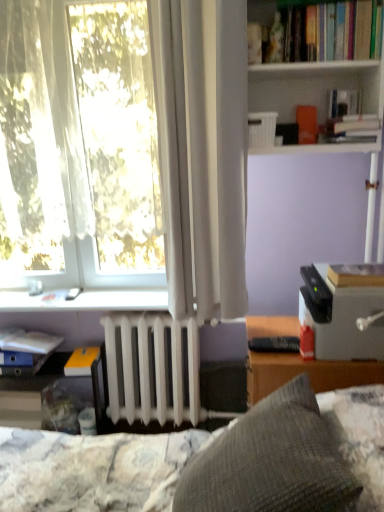
The width and height of the screenshot is (384, 512). Find the location of `hardcover book at upper right, which appears as the second book when viewed from the front`. hardcover book at upper right, which appears as the second book when viewed from the front is located at coordinates (318, 30).

Image resolution: width=384 pixels, height=512 pixels. Describe the element at coordinates (81, 361) in the screenshot. I see `yellow matte book at lower left, the first book in the back-to-front sequence` at that location.

This screenshot has width=384, height=512. In order to click on hardcover book at upper right, which appears as the first book when viewed from the top in this screenshot , I will do `click(318, 30)`.

Can you tell me how much black plastic printer at right and white plastic shelf at upper center, arranged as the 1th shelf when viewed from the front, differ in facing direction?

There is a 91.3-degree angle between the facing directions of black plastic printer at right and white plastic shelf at upper center, arranged as the 1th shelf when viewed from the front.

Looking at this image, between black plastic printer at right and white plastic shelf at upper center, the 2th shelf from the bottom, which one is positioned in front?

white plastic shelf at upper center, the 2th shelf from the bottom, is closer to the camera.

Is black plastic printer at right wider than white plastic shelf at upper center, marked as the 2th shelf in a back-to-front arrangement?

Indeed, black plastic printer at right has a greater width compared to white plastic shelf at upper center, marked as the 2th shelf in a back-to-front arrangement.

Does black plastic printer at right appear on the right side of white plastic shelf at upper center, marked as the 2th shelf in a back-to-front arrangement?

Yes.

Is black plastic printer at right located outside white plastic window sill at lower left?

Yes, black plastic printer at right is not within white plastic window sill at lower left.

Considering the relative positions of black plastic printer at right and white plastic window sill at lower left in the image provided, is black plastic printer at right to the right of white plastic window sill at lower left from the viewer's perspective?

Indeed, black plastic printer at right is positioned on the right side of white plastic window sill at lower left.

Who is shorter, black plastic printer at right or white plastic window sill at lower left?

With less height is white plastic window sill at lower left.

From the image's perspective, is hardcover book at upper center, which is counted as the 2th book, starting from the top, on top of white plastic window sill at lower left?

Correct, hardcover book at upper center, which is counted as the 2th book, starting from the top, appears higher than white plastic window sill at lower left in the image.

Is hardcover book at upper center, the 5th book from the left, to the left or to the right of white plastic window sill at lower left in the image?

hardcover book at upper center, the 5th book from the left, is to the right of white plastic window sill at lower left.

Considering the relative sizes of hardcover book at upper center, the fourth book from the bottom, and white plastic window sill at lower left in the image provided, is hardcover book at upper center, the fourth book from the bottom, bigger than white plastic window sill at lower left?

No.

Are hardcover book at upper center, the fourth book from the bottom, and white plastic window sill at lower left far apart?

Yes, hardcover book at upper center, the fourth book from the bottom, and white plastic window sill at lower left are quite far apart.

From the image's perspective, is translucent plastic shelf at lower left, which appears as the second shelf when viewed from the front, located beneath hardcover book at right, positioned as the 5th book in back-to-front order?

Yes.

Is translucent plastic shelf at lower left, which ranks as the second shelf in top-to-bottom order, directly adjacent to hardcover book at right, the 1th book from the front?

No, translucent plastic shelf at lower left, which ranks as the second shelf in top-to-bottom order, is not making contact with hardcover book at right, the 1th book from the front.

From a real-world perspective, which object rests below the other?

translucent plastic shelf at lower left, acting as the 1th shelf starting from the back.

Considering the sizes of white fabric curtain at center and white plastic shelf at upper center, marked as the 2th shelf in a back-to-front arrangement, in the image, is white fabric curtain at center bigger or smaller than white plastic shelf at upper center, marked as the 2th shelf in a back-to-front arrangement,?

Considering their sizes, white fabric curtain at center takes up less space than white plastic shelf at upper center, marked as the 2th shelf in a back-to-front arrangement.

Is white fabric curtain at center looking in the opposite direction of white plastic shelf at upper center, the 1th shelf viewed from the top?

Absolutely, white fabric curtain at center is directed away from white plastic shelf at upper center, the 1th shelf viewed from the top.

Is white fabric curtain at center taller or shorter than white plastic shelf at upper center, arranged as the 1th shelf when viewed from the front?

Clearly, white fabric curtain at center is shorter compared to white plastic shelf at upper center, arranged as the 1th shelf when viewed from the front.

You are a GUI agent. You are given a task and a screenshot of the screen. Output one action in this format:
    pyautogui.click(x=<x>, y=<y>)
    Task: Click on the 4th book positioned below the white matte bookshelf at upper right (from a real-world perspective)
    The width and height of the screenshot is (384, 512).
    Given the screenshot: What is the action you would take?
    pyautogui.click(x=81, y=361)

Is yellow matte book at lower left, which appears as the fifth book when viewed from the front, wider or thinner than white matte bookshelf at upper right?

In the image, yellow matte book at lower left, which appears as the fifth book when viewed from the front, appears to be more narrow than white matte bookshelf at upper right.

How different are the orientations of yellow matte book at lower left, the first book in the back-to-front sequence, and white matte bookshelf at upper right in degrees?

They differ by 1.59 degrees in their facing directions.

In the image, is yellow matte book at lower left, the first book in the back-to-front sequence, on the left side or the right side of white matte bookshelf at upper right?

yellow matte book at lower left, the first book in the back-to-front sequence, is positioned on white matte bookshelf at upper right's left side.

Between white matte bookshelf at upper right and hardcover book at upper center, positioned as the third book in back-to-front order, which one has larger width?

white matte bookshelf at upper right is wider.

Is point (288, 152) less distant than point (332, 118)?

That is False.

Is white matte bookshelf at upper right situated inside hardcover book at upper center, arranged as the third book when viewed from the front, or outside?

white matte bookshelf at upper right is spatially situated outside hardcover book at upper center, arranged as the third book when viewed from the front.

Between white matte bookshelf at upper right and hardcover book at upper center, the fourth book from the bottom, which one appears on the left side from the viewer's perspective?

white matte bookshelf at upper right.

The height and width of the screenshot is (512, 384). I want to click on printer that appears below the white plastic shelf at upper center, marked as the 2th shelf in a back-to-front arrangement (from a real-world perspective), so click(x=342, y=311).

The height and width of the screenshot is (512, 384). What are the coordinates of `window sill that is on the left side of black plastic printer at right` in the screenshot? It's located at (85, 301).

Looking at the image, which one is located further to hardcover book at upper right, the third book viewed from the right, hardcover book at right, which appears as the 3th book when ordered from the bottom, or black plastic printer at right?

black plastic printer at right is further to hardcover book at upper right, the third book viewed from the right.

Which object lies further to the anchor point gray textured pillow at center, white matte bookshelf at upper right or translucent plastic shelf at lower left, acting as the 1th shelf starting from the back?

translucent plastic shelf at lower left, acting as the 1th shelf starting from the back, is positioned further to the anchor gray textured pillow at center.

When comparing their distances from white plastic window sill at lower left, does hardcover book at right, the 1th book from the front, or hardcover book at upper center, which is counted as the 2th book, starting from the top, seem closer?

Based on the image, hardcover book at right, the 1th book from the front, appears to be nearer to white plastic window sill at lower left.

Based on their spatial positions, is white plastic window sill at lower left or hardcover book at right, which appears as the 4th book when viewed from the left, closer to matte blue book at lower left, acting as the fifth book starting from the right?

Among the two, white plastic window sill at lower left is located nearer to matte blue book at lower left, acting as the fifth book starting from the right.

Looking at the image, which one is located further to gray textured pillow at center, white matte bookshelf at upper right or black plastic remote control at lower center?

white matte bookshelf at upper right is positioned further to the anchor gray textured pillow at center.

From the image, which object appears to be nearer to white plastic window sill at lower left, hardcover book at upper center, arranged as the third book when viewed from the front, or matte blue book at lower left, placed as the 4th book when sorted from front to back?

Based on the image, matte blue book at lower left, placed as the 4th book when sorted from front to back, appears to be nearer to white plastic window sill at lower left.

From the image, which object appears to be nearer to white fabric curtain at center, gray textured pillow at center or hardcover book at upper right, which is the 5th book in bottom-to-top order?

Among the two, hardcover book at upper right, which is the 5th book in bottom-to-top order, is located nearer to white fabric curtain at center.

Based on their spatial positions, is translucent plastic shelf at lower left, which ranks as the second shelf in top-to-bottom order, or white matte bookshelf at upper right further from white matte radiator at center?

white matte bookshelf at upper right.

The image size is (384, 512). In order to click on remote control that lies between white fabric curtain at center and yellow matte book at lower left, which ranks as the second book in left-to-right order, from top to bottom in this screenshot , I will do `click(275, 344)`.

Where is `bookcase between hardcover book at upper right, which appears as the first book when viewed from the top, and yellow matte book at lower left, placed as the 5th book when sorted from top to bottom, from top to bottom`? Image resolution: width=384 pixels, height=512 pixels. bookcase between hardcover book at upper right, which appears as the first book when viewed from the top, and yellow matte book at lower left, placed as the 5th book when sorted from top to bottom, from top to bottom is located at coordinates click(312, 85).

What are the coordinates of `printer that lies between white fabric curtain at center and white matte radiator at center from top to bottom` in the screenshot? It's located at (342, 311).

Where is `printer between hardcover book at upper center, positioned as the third book in back-to-front order, and black plastic remote control at lower center vertically`? printer between hardcover book at upper center, positioned as the third book in back-to-front order, and black plastic remote control at lower center vertically is located at coordinates (342, 311).